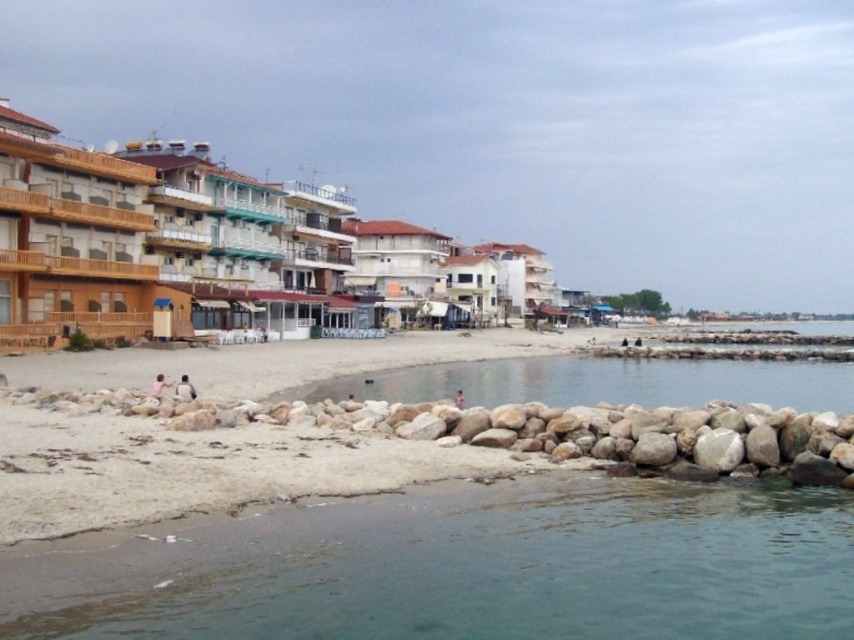
Can you confirm if wooden balconies at center is thinner than wooden balconies at left?

Incorrect, wooden balconies at center's width is not less than wooden balconies at left's.

Does wooden balconies at center lie behind wooden balconies at left?

No, wooden balconies at center is in front of wooden balconies at left.

The height and width of the screenshot is (640, 854). What do you see at coordinates (156, 241) in the screenshot?
I see `wooden balconies at center` at bounding box center [156, 241].

Where is `wooden balconies at center`? This screenshot has width=854, height=640. wooden balconies at center is located at coordinates (156, 241).

Is clear water at center taller than light brown sand at center?

No.

Locate an element on the screen. This screenshot has width=854, height=640. clear water at center is located at coordinates (604, 381).

You are a GUI agent. You are given a task and a screenshot of the screen. Output one action in this format:
    pyautogui.click(x=<x>, y=<y>)
    Task: Click on the clear water at center
    The image size is (854, 640).
    Given the screenshot: What is the action you would take?
    pyautogui.click(x=604, y=381)

Image resolution: width=854 pixels, height=640 pixels. Find the location of `clear water at center`. clear water at center is located at coordinates (604, 381).

Find the location of a particular element. wooden balconies at left is located at coordinates (69, 240).

Between point (86, 337) and point (180, 388), which one is positioned behind?

Positioned behind is point (86, 337).

Is point (154, 177) more distant than point (184, 396)?

Yes.

This screenshot has width=854, height=640. Find the location of `wooden balconies at left`. wooden balconies at left is located at coordinates (69, 240).